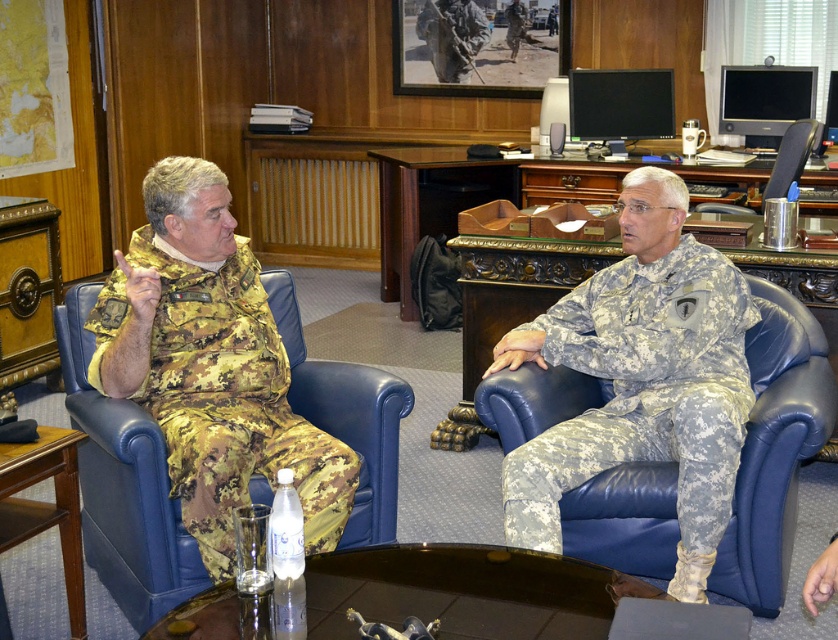
Question: Does camouflage fabric uniform at right come in front of camouflage fabric uniform at left?

Choices:
 (A) no
 (B) yes

Answer: (A)

Question: From the image, what is the correct spatial relationship of camouflage fabric uniform at right in relation to wooden desk at center?

Choices:
 (A) below
 (B) above

Answer: (A)

Question: Estimate the real-world distances between objects in this image. Which object is farther from the blue leather armchair at right?

Choices:
 (A) wooden desk at center
 (B) camouflage fabric uniform at left
 (C) camouflage fabric uniform at right
 (D) glossy glass table at center

Answer: (D)

Question: In this image, where is glossy glass table at center located relative to blue leather armchair at right?

Choices:
 (A) above
 (B) below

Answer: (B)

Question: Which point is closer to the camera?

Choices:
 (A) wooden table at lower left
 (B) camouflage fabric uniform at right
 (C) camouflage fabric uniform at left
 (D) glossy glass table at center

Answer: (D)

Question: Among these points, which one is farthest from the camera?

Choices:
 (A) (216, 269)
 (B) (591, 573)

Answer: (A)